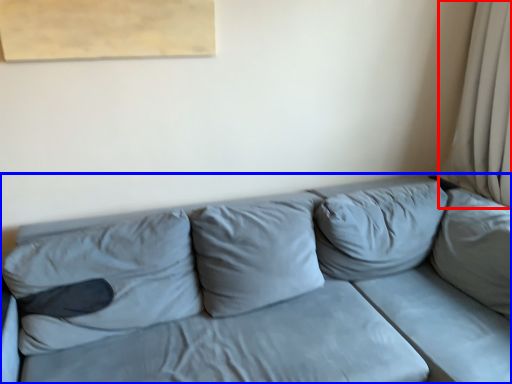
Question: Which of the following is the farthest to the observer, curtain (highlighted by a red box) or studio couch (highlighted by a blue box)?

Choices:
 (A) curtain
 (B) studio couch

Answer: (A)